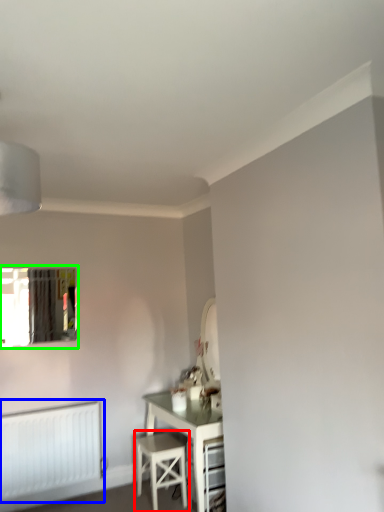
Question: Estimate the real-world distances between objects in this image. Which object is farther from stool (highlighted by a red box), radiator (highlighted by a blue box) or window (highlighted by a green box)?

Choices:
 (A) radiator
 (B) window

Answer: (B)